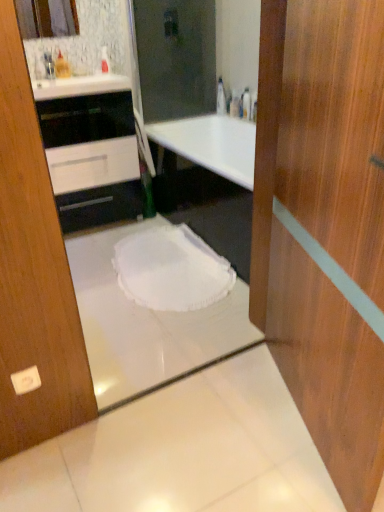
Question: Can you confirm if transparent plastic bottle at upper center is smaller than white fabric toilet at center?

Choices:
 (A) yes
 (B) no

Answer: (A)

Question: Does transparent plastic bottle at upper center touch white fabric toilet at center?

Choices:
 (A) no
 (B) yes

Answer: (A)

Question: Can you confirm if transparent plastic bottle at upper center is thinner than white fabric toilet at center?

Choices:
 (A) yes
 (B) no

Answer: (A)

Question: Can you confirm if transparent plastic bottle at upper center is bigger than white fabric toilet at center?

Choices:
 (A) yes
 (B) no

Answer: (B)

Question: Can we say transparent plastic bottle at upper center lies outside white fabric toilet at center?

Choices:
 (A) no
 (B) yes

Answer: (B)

Question: Is transparent plastic bottle at upper center positioned behind white fabric toilet at center?

Choices:
 (A) yes
 (B) no

Answer: (A)

Question: Is matte glass mirror at upper left bigger than black glossy cabinet at upper left?

Choices:
 (A) yes
 (B) no

Answer: (B)

Question: Does matte glass mirror at upper left lie behind black glossy cabinet at upper left?

Choices:
 (A) yes
 (B) no

Answer: (A)

Question: Can you confirm if matte glass mirror at upper left is shorter than black glossy cabinet at upper left?

Choices:
 (A) yes
 (B) no

Answer: (A)

Question: From a real-world perspective, is matte glass mirror at upper left over black glossy cabinet at upper left?

Choices:
 (A) no
 (B) yes

Answer: (B)

Question: Is matte glass mirror at upper left facing towards black glossy cabinet at upper left?

Choices:
 (A) no
 (B) yes

Answer: (A)

Question: Is there a large distance between matte glass mirror at upper left and black glossy cabinet at upper left?

Choices:
 (A) no
 (B) yes

Answer: (A)

Question: Is transparent plastic bottle at upper center next to black glossy cabinet at upper left?

Choices:
 (A) no
 (B) yes

Answer: (A)